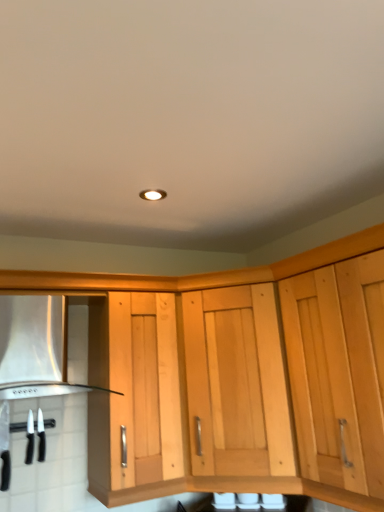
Question: Is the surface of black plastic knife at lower left, the 1th kitchen appliance from the right, in direct contact with natural wood cabinet at center?

Choices:
 (A) no
 (B) yes

Answer: (A)

Question: From a real-world perspective, is black plastic knife at lower left, the 1th kitchen appliance from the right, positioned under natural wood cabinet at center based on gravity?

Choices:
 (A) yes
 (B) no

Answer: (A)

Question: Is natural wood cabinet at center at the back of black plastic knife at lower left, placed as the second kitchen appliance when sorted from left to right?

Choices:
 (A) no
 (B) yes

Answer: (A)

Question: From a real-world perspective, is black plastic knife at lower left, placed as the second kitchen appliance when sorted from left to right, over natural wood cabinet at center?

Choices:
 (A) yes
 (B) no

Answer: (B)

Question: Can you confirm if black plastic knife at lower left, the 1th kitchen appliance from the right, is taller than natural wood cabinet at center?

Choices:
 (A) no
 (B) yes

Answer: (A)

Question: Looking at their shapes, would you say black plastic knives at lower left, marked as the second kitchen appliance in a right-to-left arrangement, is wider or thinner than black plastic knife at lower left, placed as the second kitchen appliance when sorted from left to right?

Choices:
 (A) wide
 (B) thin

Answer: (A)

Question: Is black plastic knives at lower left, marked as the second kitchen appliance in a right-to-left arrangement, taller or shorter than black plastic knife at lower left, placed as the second kitchen appliance when sorted from left to right?

Choices:
 (A) short
 (B) tall

Answer: (B)

Question: Relative to black plastic knife at lower left, the 1th kitchen appliance from the right, is black plastic knives at lower left, which is counted as the 1th kitchen appliance, starting from the left, in front or behind?

Choices:
 (A) front
 (B) behind

Answer: (A)

Question: From the image's perspective, relative to black plastic knife at lower left, the 1th kitchen appliance from the right, is black plastic knives at lower left, marked as the second kitchen appliance in a right-to-left arrangement, above or below?

Choices:
 (A) below
 (B) above

Answer: (A)

Question: From the image's perspective, relative to satin silver vent at lower left, is black plastic knife at lower left, the 1th kitchen appliance from the right, above or below?

Choices:
 (A) above
 (B) below

Answer: (B)

Question: Is point (43, 458) closer or farther from the camera than point (46, 334)?

Choices:
 (A) farther
 (B) closer

Answer: (A)

Question: In terms of height, does black plastic knife at lower left, the 1th kitchen appliance from the right, look taller or shorter compared to satin silver vent at lower left?

Choices:
 (A) short
 (B) tall

Answer: (A)

Question: Choose the correct answer: Is black plastic knife at lower left, the 1th kitchen appliance from the right, inside satin silver vent at lower left or outside it?

Choices:
 (A) outside
 (B) inside

Answer: (A)

Question: Is black plastic knife at lower left, the 1th kitchen appliance from the right, to the left or to the right of natural wood cabinet at center in the image?

Choices:
 (A) right
 (B) left

Answer: (B)

Question: Which is correct: black plastic knife at lower left, placed as the second kitchen appliance when sorted from left to right, is inside natural wood cabinet at center, or outside of it?

Choices:
 (A) inside
 (B) outside

Answer: (B)